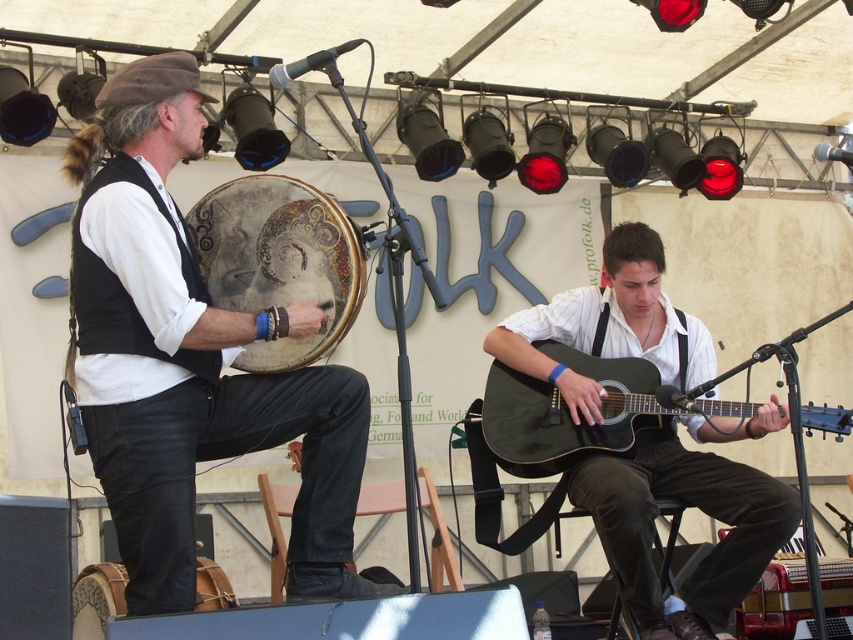
You are a stagehand setting up for the performance. You need to place a microphone stand between the matte black drum at left and the distressed leather drum at center. Since the microphone stand requires a minimum of 1.2 meters of space between the drums to fit, can you determine if there is enough space based on their height difference?

The matte black drum at left is much taller than the distressed leather drum at center, but height difference does not determine the horizontal space between them. The question about space for the microphone stand cannot be answered with the given information about their heights.

Consider the image. You are a photographer positioned at the center of the stage. You want to capture a closeup shot of the matte black drum at left. Based on its 2D coordinates, which direction should you move to get closer to it?

The matte black drum at left is located at coordinates 0.562 on the x axis and 0.225 on the y axis. Since you are at the center of the stage, which is at coordinates (426, 320), you should move slightly to the left and down to get closer to the drum.

You are a photographer at the festival and want to take a photo of the drummer. You notice the matte black drum at left and the distressed leather drum at center. Which drum should you focus on to ensure the drummer is in the foreground of your photo?

You should focus on the matte black drum at left because it is closer to the viewer than the distressed leather drum at center, placing the drummer in the foreground.